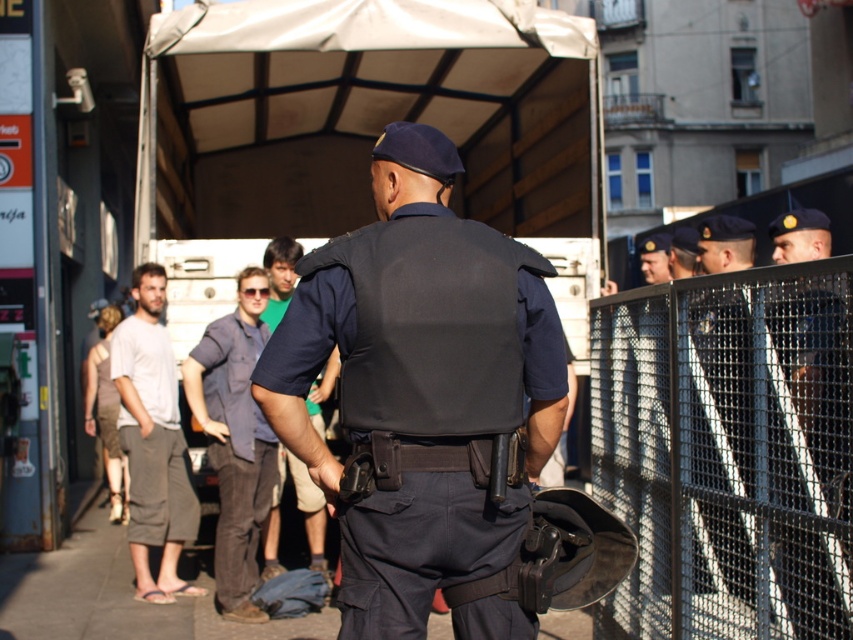
Which of these two, navy blue uniform at center or dark blue shirt at center, stands shorter?

dark blue shirt at center is shorter.

Who is positioned more to the left, navy blue uniform at center or dark blue shirt at center?

dark blue shirt at center

Identify the location of navy blue uniform at center. (419, 385).

Identify the location of navy blue uniform at center. (419, 385).

Can you confirm if metallic mesh fence at right is shorter than gray cotton shorts at left?

Yes.

How far apart are metallic mesh fence at right and gray cotton shorts at left?

metallic mesh fence at right is 12.61 feet from gray cotton shorts at left.

I want to click on metallic mesh fence at right, so click(x=728, y=452).

Does point (595, 481) lie in front of point (270, 276)?

Yes.

Who is positioned more to the left, metallic mesh fence at right or dark blue shirt at center?

Positioned to the left is dark blue shirt at center.

Who is more distant from viewer, (778,396) or (276,568)?

The point (276,568) is behind.

This screenshot has height=640, width=853. In order to click on metallic mesh fence at right in this screenshot , I will do `click(728, 452)`.